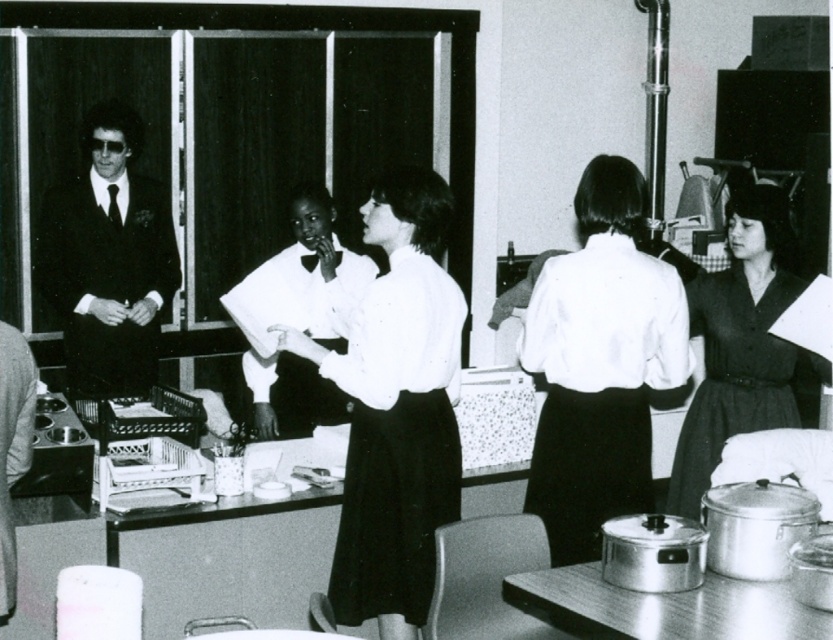
Is matte black suit at left positioned behind matte black dress at right?

Yes, matte black suit at left is further from the viewer.

Does matte black suit at left appear over matte black dress at right?

Yes, matte black suit at left is above matte black dress at right.

Is point (146, 284) behind point (746, 294)?

That is True.

Locate an element on the screen. matte black suit at left is located at coordinates (108, 259).

Which is below, white smooth blouse at center or smooth leather jacket at left?

smooth leather jacket at left

Does white smooth blouse at center have a greater height compared to smooth leather jacket at left?

Yes, white smooth blouse at center is taller than smooth leather jacket at left.

Who is more distant from viewer, (637, 323) or (0, 516)?

The point (637, 323) is behind.

Find the location of `white smooth blouse at center`. white smooth blouse at center is located at coordinates (600, 364).

Who is lower down, white smooth blouse at center or matte black dress at right?

matte black dress at right

Which is above, white smooth blouse at center or matte black dress at right?

white smooth blouse at center

Does point (615, 444) come behind point (692, 296)?

That is False.

This screenshot has height=640, width=833. In order to click on white smooth blouse at center in this screenshot , I will do `click(600, 364)`.